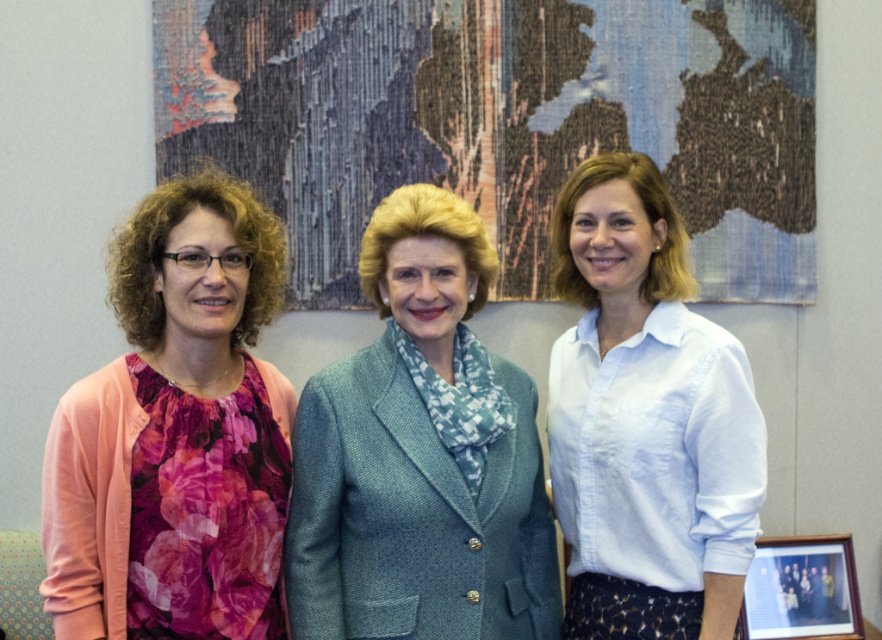
Question: Which point is farther from the camera taking this photo?

Choices:
 (A) (694, 493)
 (B) (787, 552)
 (C) (542, 502)
 (D) (204, 497)

Answer: (B)

Question: Which point is farther to the camera?

Choices:
 (A) floral fabric blouse at left
 (B) white cotton shirt at center
 (C) teal woolen blazer at center
 (D) textured fabric map at upper center

Answer: (D)

Question: In this image, where is textured fabric map at upper center located relative to teal woolen blazer at center?

Choices:
 (A) left
 (B) right

Answer: (B)

Question: Which object is the farthest from the floral fabric blouse at left?

Choices:
 (A) wooden picture frame at lower right
 (B) textured fabric map at upper center
 (C) teal woolen blazer at center
 (D) white cotton shirt at center

Answer: (A)

Question: Can you confirm if floral fabric blouse at left is positioned to the right of white cotton shirt at center?

Choices:
 (A) yes
 (B) no

Answer: (B)

Question: Does floral fabric blouse at left lie in front of teal woolen blazer at center?

Choices:
 (A) yes
 (B) no

Answer: (A)